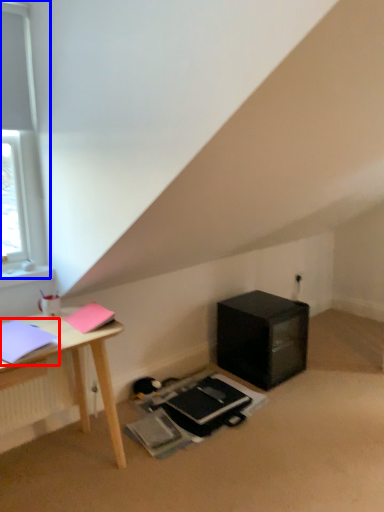
Question: Which point is further to the camera, notebook (highlighted by a red box) or window (highlighted by a blue box)?

Choices:
 (A) notebook
 (B) window

Answer: (B)